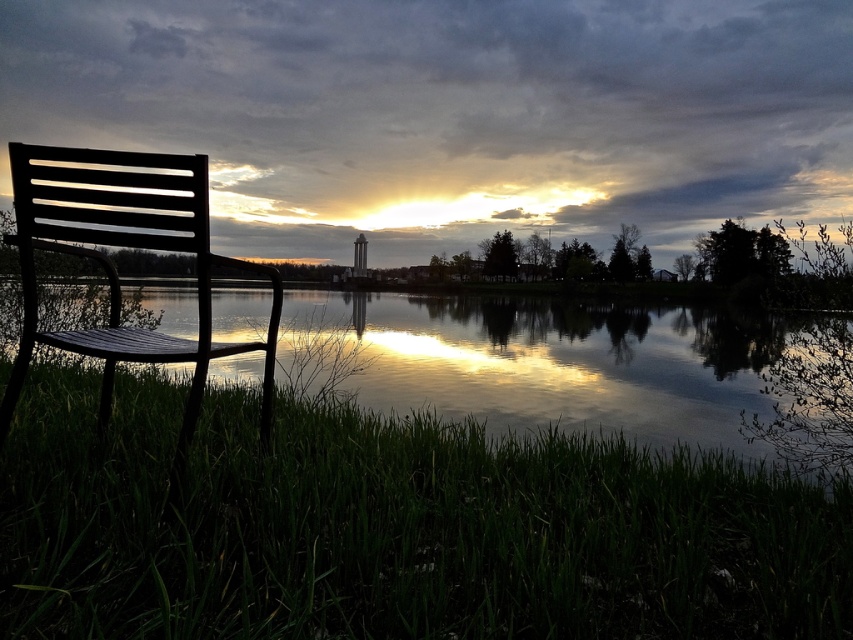
You are a photographer wanting to capture the reflection of the black metal chair at left in the glossy water at chair left. Based on the scene, will the reflection be fully visible? Please explain your reasoning.

The glossy water at chair left has a greater height compared to the black metal chair at left. Since the water is taller, the reflection of the black metal chair at left should be fully visible in the glossy water at chair left.

You are standing at the point marked by the coordinates point [393,529]. Looking around, you see the green grass at lower left. Which direction should you walk to reach the lakeside?

The green grass at lower left is located at point [393,529]. Since the lakeside is in the center, you should walk towards the center to reach the lakeside from that point.